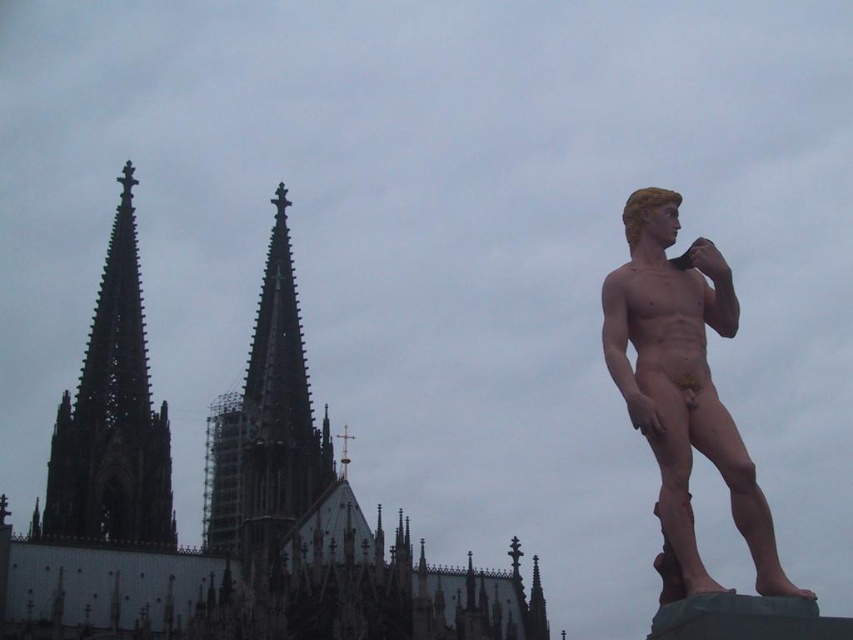
Between matte bronze statue at right and dark gray stone spire at upper left, which one appears on the right side from the viewer's perspective?

From the viewer's perspective, matte bronze statue at right appears more on the right side.

Which of these two, matte bronze statue at right or dark gray stone spire at upper left, stands shorter?

Standing shorter between the two is matte bronze statue at right.

This screenshot has width=853, height=640. I want to click on matte bronze statue at right, so click(682, 381).

This screenshot has width=853, height=640. I want to click on matte bronze statue at right, so click(682, 381).

Between dark gray stone spire at upper left and dark gray stone spire at center, which one is positioned higher?

dark gray stone spire at upper left is above.

Can you confirm if dark gray stone spire at upper left is positioned to the right of dark gray stone spire at center?

In fact, dark gray stone spire at upper left is to the left of dark gray stone spire at center.

Does point (97, 388) lie in front of point (279, 515)?

No, it is not.

The width and height of the screenshot is (853, 640). I want to click on dark gray stone spire at upper left, so [x=112, y=417].

Is point (88, 618) less distant than point (120, 432)?

Yes.

Can you confirm if dark gray stone cathedral at left is positioned above dark gray stone spire at upper left?

Actually, dark gray stone cathedral at left is below dark gray stone spire at upper left.

Find the location of `dark gray stone cathedral at left`. dark gray stone cathedral at left is located at coordinates (224, 506).